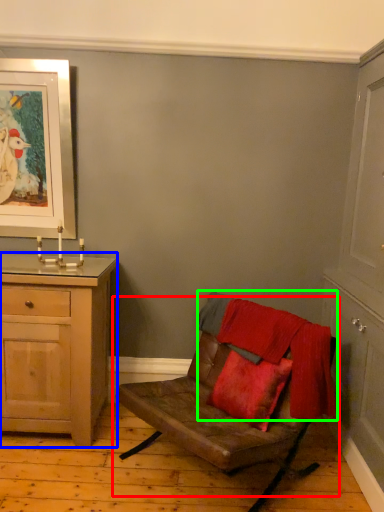
Question: Based on their relative distances, which object is nearer to chair (highlighted by a red box)? Choose from chest of drawers (highlighted by a blue box) and blanket (highlighted by a green box).

Choices:
 (A) chest of drawers
 (B) blanket

Answer: (B)